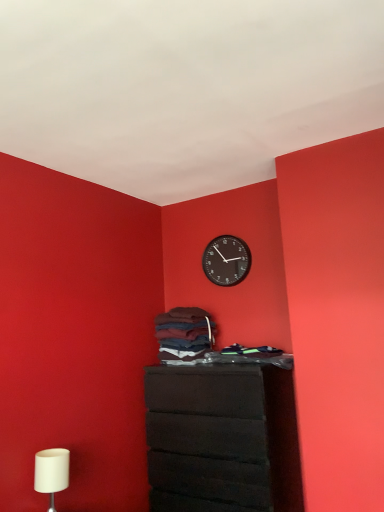
Question: Visually, is dark blue cotton laundry at center positioned to the left or to the right of black plastic wall clock at upper center?

Choices:
 (A) left
 (B) right

Answer: (A)

Question: Considering their positions, is dark blue cotton laundry at center located in front of or behind black plastic wall clock at upper center?

Choices:
 (A) front
 (B) behind

Answer: (A)

Question: Which object is positioned closest to the matte black chest of drawers at center?

Choices:
 (A) white matte table lamp at lower left
 (B) dark blue cotton laundry at center
 (C) black plastic wall clock at upper center

Answer: (B)

Question: Which object is positioned farthest from the matte black chest of drawers at center?

Choices:
 (A) white matte table lamp at lower left
 (B) black plastic wall clock at upper center
 (C) dark blue cotton laundry at center

Answer: (B)